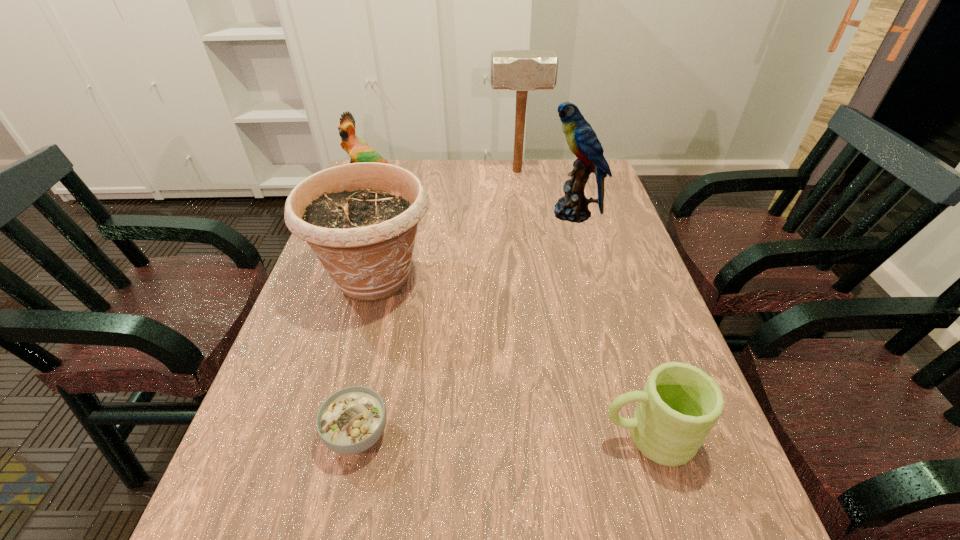
In the image, there is a desktop. In order to click on vacant space at the near left corner in this screenshot , I will do `click(231, 536)`.

Identify the location of vacant region at the far right corner. The width and height of the screenshot is (960, 540). (608, 179).

This screenshot has height=540, width=960. Identify the location of free space that is in between the mallet and the right parrot. (545, 192).

The height and width of the screenshot is (540, 960). In order to click on vacant area that lies between the soup bowl and the shorter parrot in this screenshot , I will do `click(364, 314)`.

What are the coordinates of `vacant space in between the soup bowl and the second tallest object` in the screenshot? It's located at (465, 323).

Identify the location of vacant space that is in between the soup bowl and the shorter parrot. (364, 314).

Where is `free spot between the flowerpot and the right parrot`? The image size is (960, 540). free spot between the flowerpot and the right parrot is located at coordinates (473, 246).

You are a GUI agent. You are given a task and a screenshot of the screen. Output one action in this format:
    pyautogui.click(x=<x>, y=<y>)
    Task: Click on the free space between the fifth tallest object and the shortest object
    
    Given the screenshot: What is the action you would take?
    pos(502,435)

The height and width of the screenshot is (540, 960). What are the coordinates of `empty location between the shortest object and the taller parrot` in the screenshot? It's located at pyautogui.click(x=465, y=323).

Image resolution: width=960 pixels, height=540 pixels. What are the coordinates of `vacant region between the left parrot and the taller parrot` in the screenshot? It's located at (471, 204).